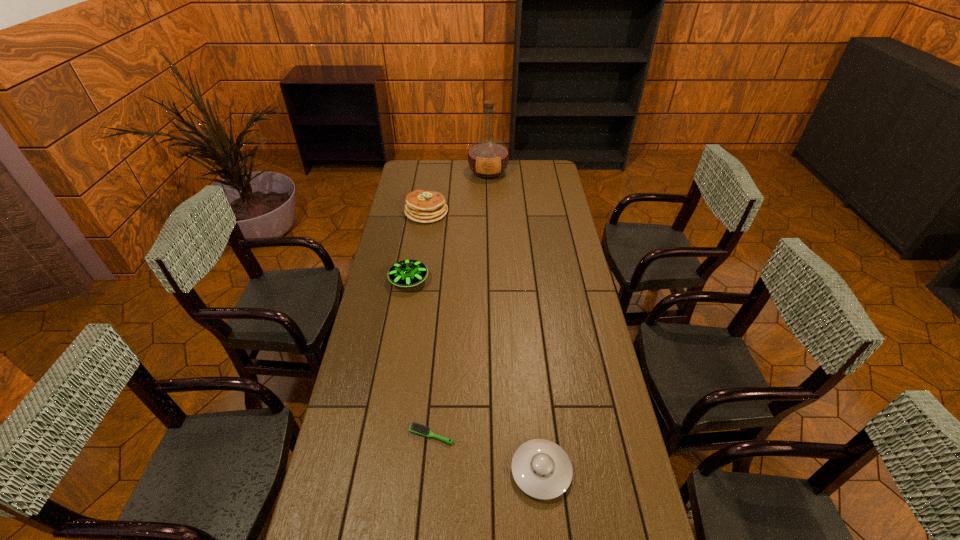
Where is `blank area located 0.080m on the right of the fourth shortest object`? blank area located 0.080m on the right of the fourth shortest object is located at coordinates tap(465, 212).

Find the location of a particular element. This screenshot has width=960, height=540. vacant space located 0.110m on the right of the farther saucer is located at coordinates (456, 280).

Where is `free space located 0.330m on the left of the second shortest object`? free space located 0.330m on the left of the second shortest object is located at coordinates (391, 471).

Identify the location of vacant space located 0.120m on the front of the shortest object. (427, 490).

Image resolution: width=960 pixels, height=540 pixels. I want to click on object situated at the far edge, so click(488, 157).

Locate an element on the screen. pancake present at the left edge is located at coordinates (421, 206).

This screenshot has width=960, height=540. What are the coordinates of `saucer at the left edge` in the screenshot? It's located at (407, 273).

In the image, there is a desktop. Identify the location of vacant space at the far edge. [x=455, y=176].

Identify the location of vacant area at the left edge. Image resolution: width=960 pixels, height=540 pixels. (423, 227).

Image resolution: width=960 pixels, height=540 pixels. I want to click on vacant area at the right edge of the desktop, so click(557, 352).